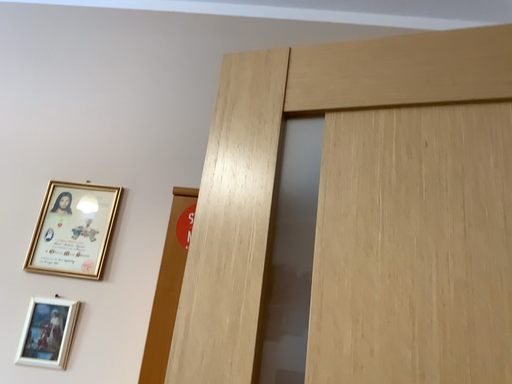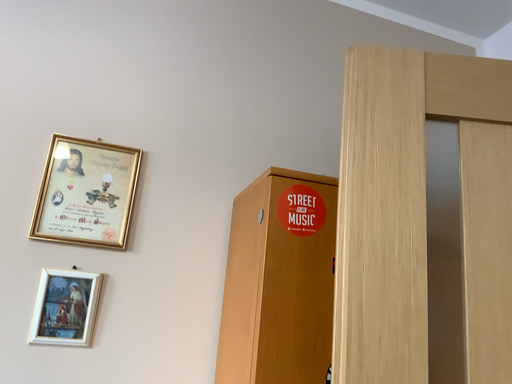
Question: Which way did the camera rotate in the video?

Choices:
 (A) rotated upward
 (B) rotated downward

Answer: (B)